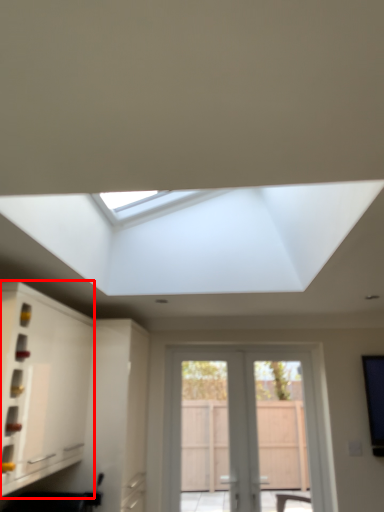
Question: Observing the image, what is the correct spatial positioning of cabinetry (annotated by the red box) in reference to door?

Choices:
 (A) right
 (B) left

Answer: (B)